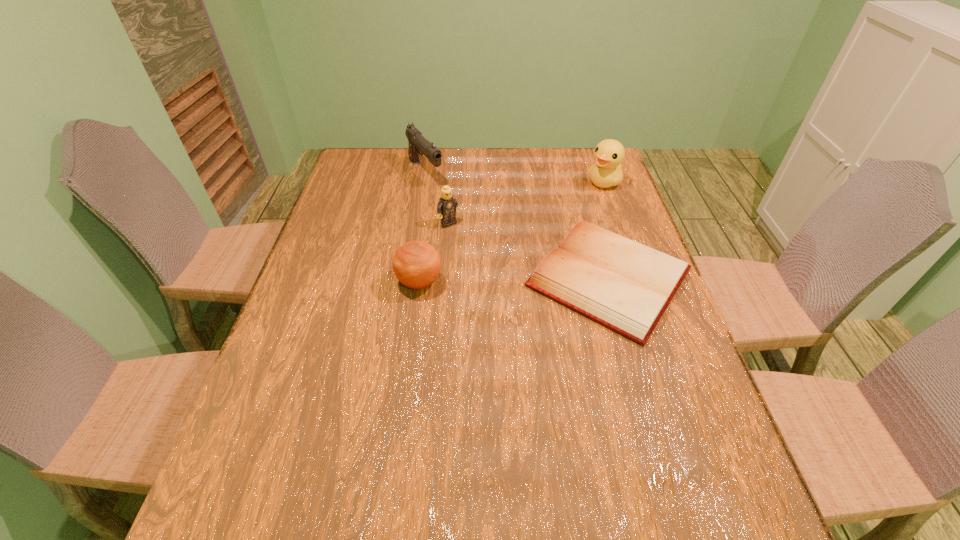
The width and height of the screenshot is (960, 540). Identify the location of object that is positioned at the far right corner. (608, 154).

In the image, there is a desktop. Identify the location of free space at the far edge. (520, 176).

In the image, there is a desktop. At what (x,y) coordinates should I click in order to perform the action: click on vacant space at the near edge. Please return your answer as a coordinate pair (x, y). The image size is (960, 540). Looking at the image, I should click on point(454,437).

Where is `vacant area at the left edge of the desktop`? vacant area at the left edge of the desktop is located at coordinates (355, 194).

You are a GUI agent. You are given a task and a screenshot of the screen. Output one action in this format:
    pyautogui.click(x=<x>, y=<y>)
    Task: Click on the vacant space at the far left corner of the desktop
    This screenshot has width=960, height=540.
    Given the screenshot: What is the action you would take?
    pyautogui.click(x=355, y=149)

Find the location of a particular element. The height and width of the screenshot is (540, 960). vacant point located between the orange and the shortest object is located at coordinates (515, 280).

Identify the location of vacant space that is in between the gun and the orange. (422, 227).

You are a GUI agent. You are given a task and a screenshot of the screen. Output one action in this format:
    pyautogui.click(x=<x>, y=<y>)
    Task: Click on the free space between the Bible and the duck
    This screenshot has height=540, width=960.
    Given the screenshot: What is the action you would take?
    pyautogui.click(x=607, y=230)

Identify the location of free space that is in between the gun and the Lego. (438, 198).

At what (x,y) coordinates should I click in order to perform the action: click on vacant space that's between the duck and the Bible. Please return your answer as a coordinate pair (x, y). The image size is (960, 540). Looking at the image, I should click on (607, 230).